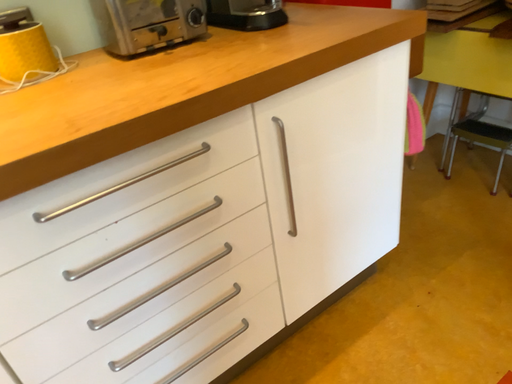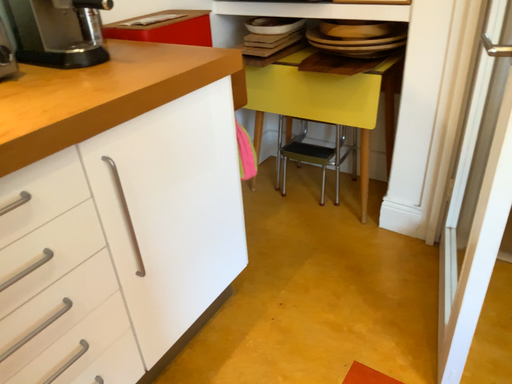
Question: Which way did the camera rotate in the video?

Choices:
 (A) rotated left
 (B) rotated right

Answer: (B)